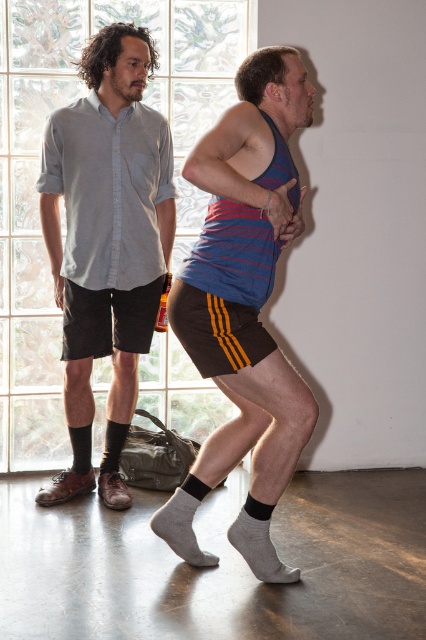
You are standing in the room and want to place a small sticker exactly at the point with coordinates (x=244, y=307). According to the scene, where will the sticker be placed?

The point with coordinates (x=244, y=307) is on striped cotton tank top at center, so the sticker will be placed on the striped cotton tank top at center.

You are a photographer setting up a shoot in the scene described. You need to place a small tripod between the gray wool sock at lower center and the black matte sock at lower left. Considering their sizes, which sock should the tripod be closer to to ensure stability?

The gray wool sock at lower center is bigger than the black matte sock at lower left. To ensure stability, the tripod should be placed closer to the gray wool sock at lower center because its larger size provides a more stable base.

You are a housekeeper cleaning the living room. You see the gray cotton sock at lower center and the black cotton sock at lower left. The distance between them is crucial for your cleaning path. Can you safely pass between them if your vacuum cleaner is 3 feet wide?

The gray cotton sock at lower center is 3.67 feet from the black cotton sock at lower left. Since the vacuum cleaner is 3 feet wide, there is enough space between them for the vacuum to pass through safely.